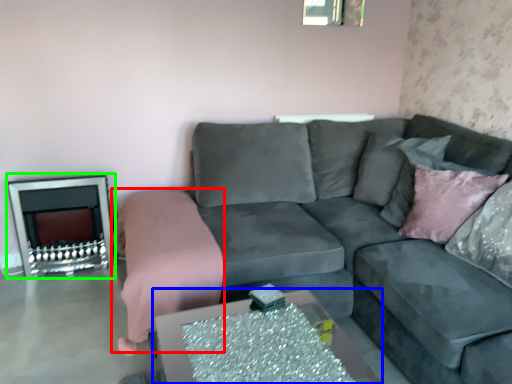
Question: Based on their relative distances, which object is farther from bedding (highlighted by a red box)? Choose from table (highlighted by a blue box) and fireplace (highlighted by a green box).

Choices:
 (A) table
 (B) fireplace

Answer: (A)